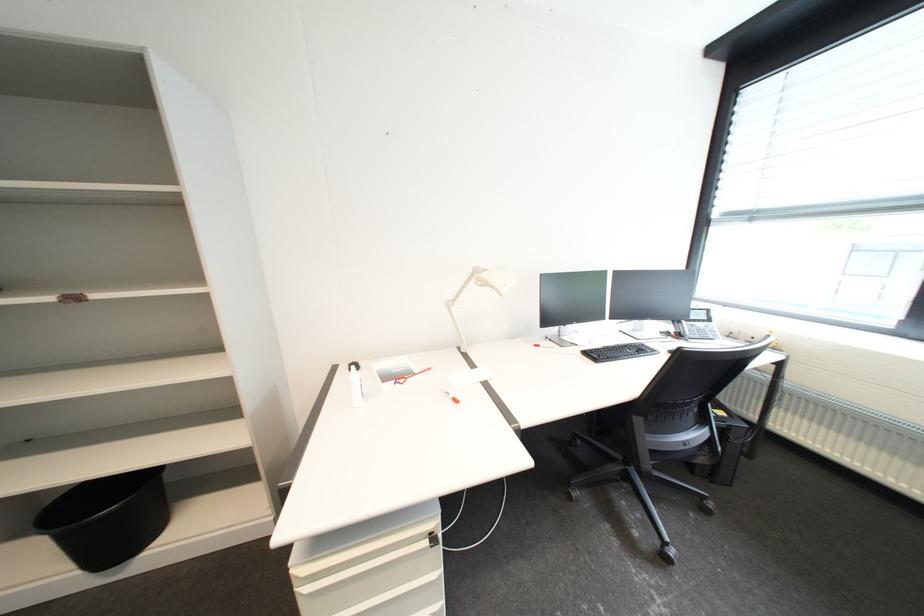
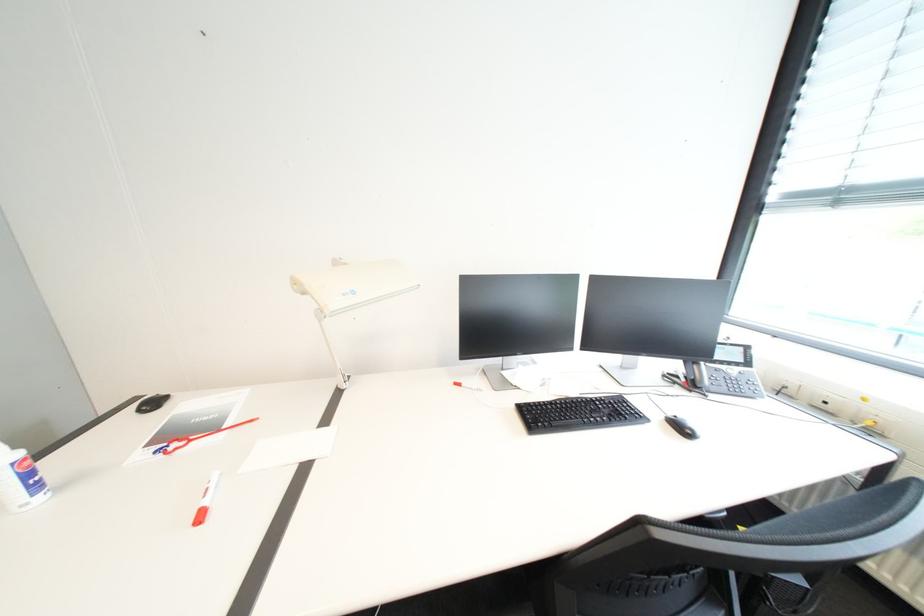
The images are taken continuously from a first-person perspective. In which direction are you moving?

The movement direction of the cameraman is right, forward.